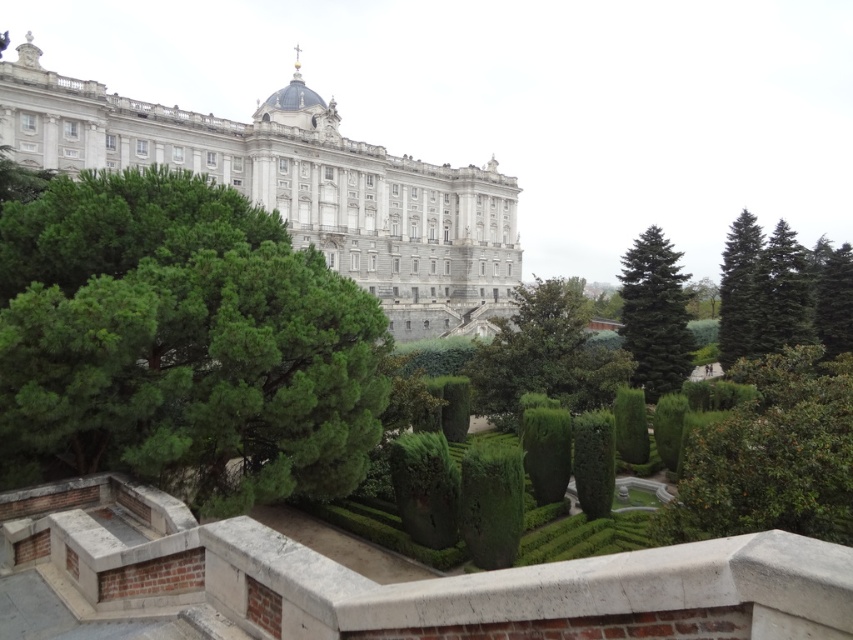
Who is lower down, green leafy bush at center-right or green fir tree at right?

Positioned lower is green leafy bush at center-right.

Between point (809, 396) and point (769, 349), which one is positioned in front?

Point (809, 396) is in front.

Where is `green leafy bush at center-right`? green leafy bush at center-right is located at coordinates (770, 456).

Can you confirm if white marble palace at upper center is shorter than green textured tree at upper right?

In fact, white marble palace at upper center may be taller than green textured tree at upper right.

What do you see at coordinates (299, 188) in the screenshot? Image resolution: width=853 pixels, height=640 pixels. I see `white marble palace at upper center` at bounding box center [299, 188].

This screenshot has width=853, height=640. What are the coordinates of `white marble palace at upper center` in the screenshot? It's located at (299, 188).

Who is more distant from viewer, [624,282] or [780,310]?

Positioned behind is point [624,282].

Which is below, dark green coniferous tree at center-right or green fir tree at right?

dark green coniferous tree at center-right is lower down.

Describe the element at coordinates (654, 314) in the screenshot. Image resolution: width=853 pixels, height=640 pixels. I see `dark green coniferous tree at center-right` at that location.

Locate an element on the screen. dark green coniferous tree at center-right is located at coordinates (654, 314).